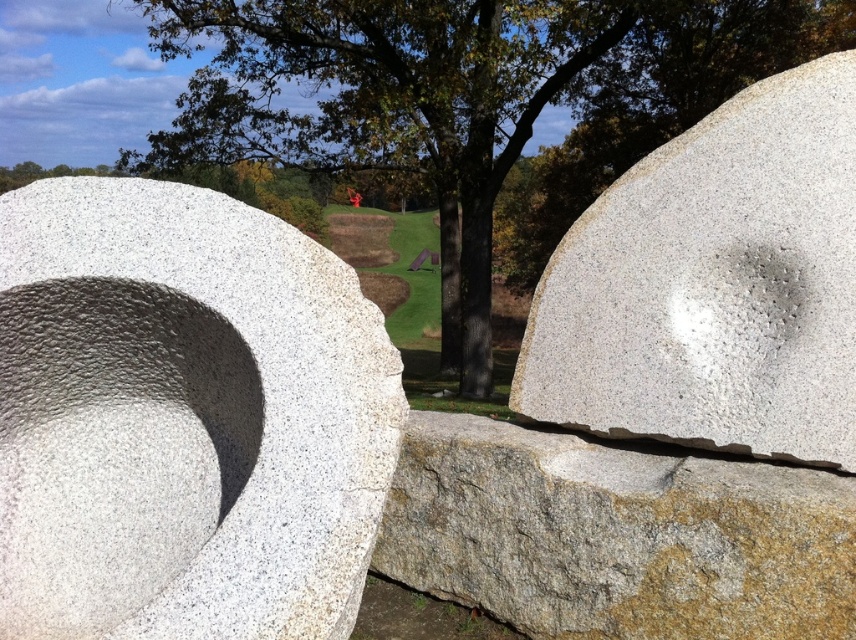
You are standing in the outdoor scene and want to place a small statue between the white textured stone at center and the green leafy tree at center. Based on their positions, where should you place the statue to ensure it is between them?

The white textured stone at center is below the green leafy tree at center, so placing the statue between them would require positioning it above the white textured stone at center and below the green leafy tree at center.

From the picture: You are a hiker standing at the base of the gray rough concrete at center and want to reach the green leafy tree at center. Which direction should you move to get closer to the tree?

The green leafy tree at center is much taller than the gray rough concrete at center, so you should look upward to see the tree since it is taller.

You are planning to take a photo of the green leafy tree at center and the gray rough concrete at center. Which object should you focus on first if you want to capture both in a single frame without moving the camera?

You should focus on the green leafy tree at center first because it is larger in size than the gray rough concrete at center, making it a more prominent subject to center the composition around.